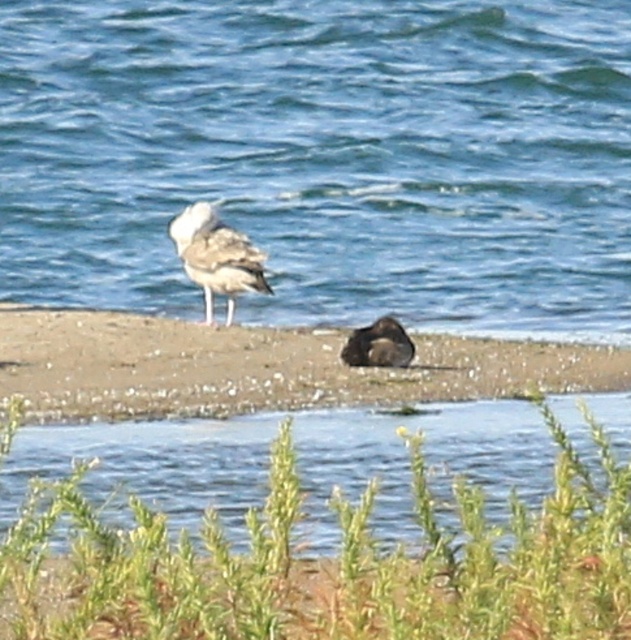
Can you confirm if blue water at center is shorter than green leafy plant at lower center?

No.

Which is above, blue water at center or green leafy plant at lower center?

Positioned higher is blue water at center.

Which is behind, point (377, 8) or point (425, 595)?

The point (377, 8) is behind.

This screenshot has width=631, height=640. Find the location of `blue water at center`. blue water at center is located at coordinates (326, 157).

Which is below, green leafy plant at lower center or white feathered bird at center?

green leafy plant at lower center is below.

Is point (254, 588) positioned after point (192, 230)?

No, (254, 588) is in front of (192, 230).

Is point (150, 532) behind point (256, 268)?

No, it is in front of (256, 268).

Find the location of a particular element. This screenshot has height=640, width=631. green leafy plant at lower center is located at coordinates (331, 564).

Can you confirm if green leafy plant at lower center is positioned above brown fuzzy bird at center?

No.

Is green leafy plant at lower center further to the viewer compared to brown fuzzy bird at center?

No, it is in front of brown fuzzy bird at center.

Is point (49, 573) farther from camera compared to point (360, 356)?

No, it is in front of (360, 356).

Locate an element on the screen. The height and width of the screenshot is (640, 631). green leafy plant at lower center is located at coordinates pyautogui.click(x=331, y=564).